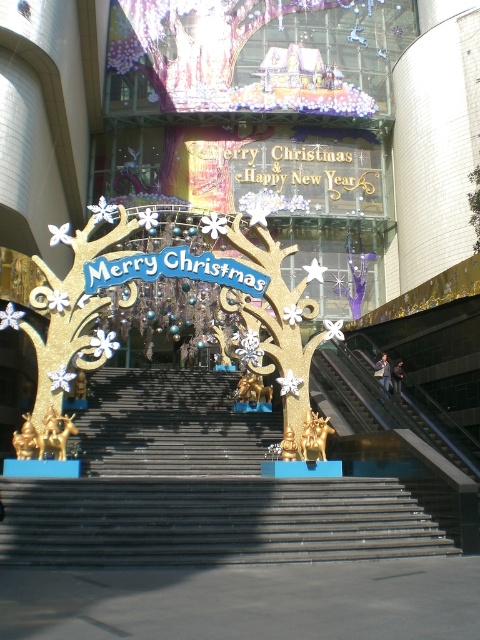
Question: Can you confirm if black smooth stairs at center is positioned above gold glittery tree at center?

Choices:
 (A) yes
 (B) no

Answer: (B)

Question: Which point appears farthest from the camera in this image?

Choices:
 (A) (220, 506)
 (B) (33, 428)

Answer: (B)

Question: Which is farther from the black smooth stairs at center?

Choices:
 (A) gold glittering tree at center
 (B) gold glittery tree at center

Answer: (B)

Question: Which object is closer to the camera taking this photo?

Choices:
 (A) black smooth stairs at center
 (B) gold glittery tree at center

Answer: (A)

Question: Where is black smooth stairs at center located in relation to gold glittery tree at center in the image?

Choices:
 (A) right
 (B) left

Answer: (A)

Question: Can you confirm if gold glittery tree at center is thinner than gold glittering tree at center?

Choices:
 (A) yes
 (B) no

Answer: (B)